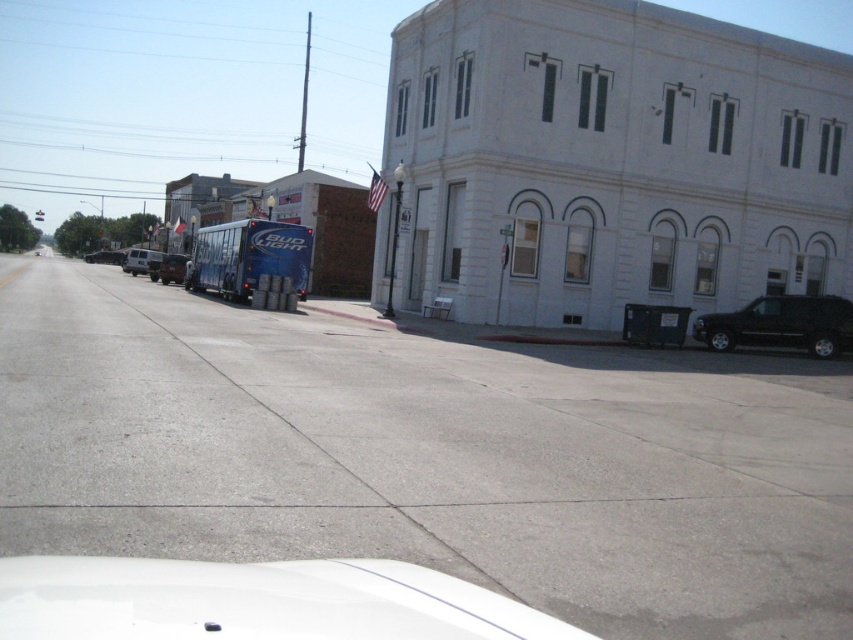
Can you confirm if black matte suv at lower right is positioned to the right of metallic silver van at center-left?

Correct, you'll find black matte suv at lower right to the right of metallic silver van at center-left.

Locate an element on the screen. The image size is (853, 640). black matte suv at lower right is located at coordinates (781, 324).

Which is behind, point (825, 300) or point (183, 262)?

The point (183, 262) is behind.

This screenshot has width=853, height=640. I want to click on black matte suv at lower right, so pos(781,324).

Between white stone building at upper right and metallic silver van at center-left, which one is positioned lower?

metallic silver van at center-left is lower down.

Is point (759, 72) positioned behind point (170, 266)?

No, it is not.

At what (x,y) coordinates should I click in order to perform the action: click on white stone building at upper right. Please return your answer as a coordinate pair (x, y). Looking at the image, I should click on (608, 163).

Can you confirm if white stone building at upper right is wider than matte black van at left?

No.

Does white stone building at upper right appear on the left side of matte black van at left?

In fact, white stone building at upper right is to the right of matte black van at left.

Between point (824, 195) and point (117, 250), which one is positioned behind?

Point (117, 250)

The image size is (853, 640). I want to click on white stone building at upper right, so click(x=608, y=163).